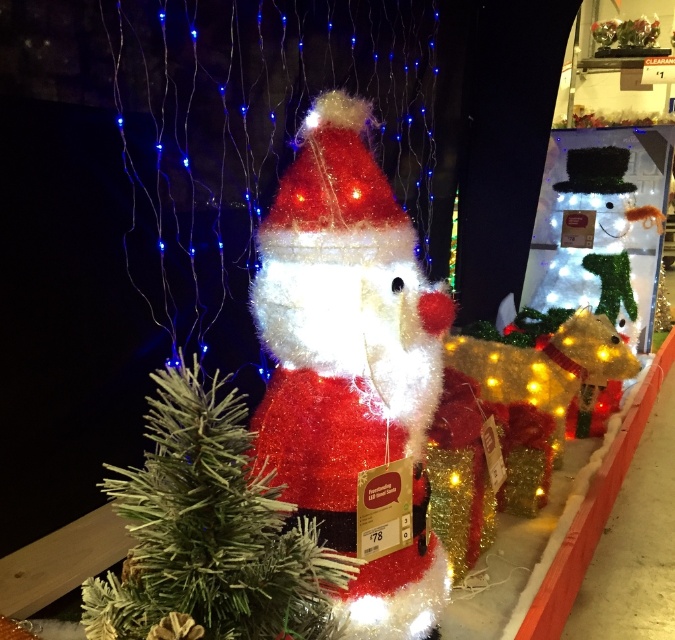
Question: Can you confirm if fuzzy tinsel santa at center is positioned above frosted tinsel santa at center?

Choices:
 (A) no
 (B) yes

Answer: (B)

Question: Does fuzzy tinsel santa at center have a smaller size compared to frosted tinsel santa at center?

Choices:
 (A) yes
 (B) no

Answer: (B)

Question: Which object is closer to the camera taking this photo?

Choices:
 (A) fuzzy tinsel santa at center
 (B) frosted tinsel santa at center

Answer: (B)

Question: Among these points, which one is nearest to the camera?

Choices:
 (A) (292, 566)
 (B) (402, 337)

Answer: (A)

Question: Is fuzzy tinsel santa at center below frosted tinsel santa at center?

Choices:
 (A) no
 (B) yes

Answer: (A)

Question: Among these points, which one is nearest to the camera?

Choices:
 (A) (126, 499)
 (B) (351, 188)

Answer: (A)